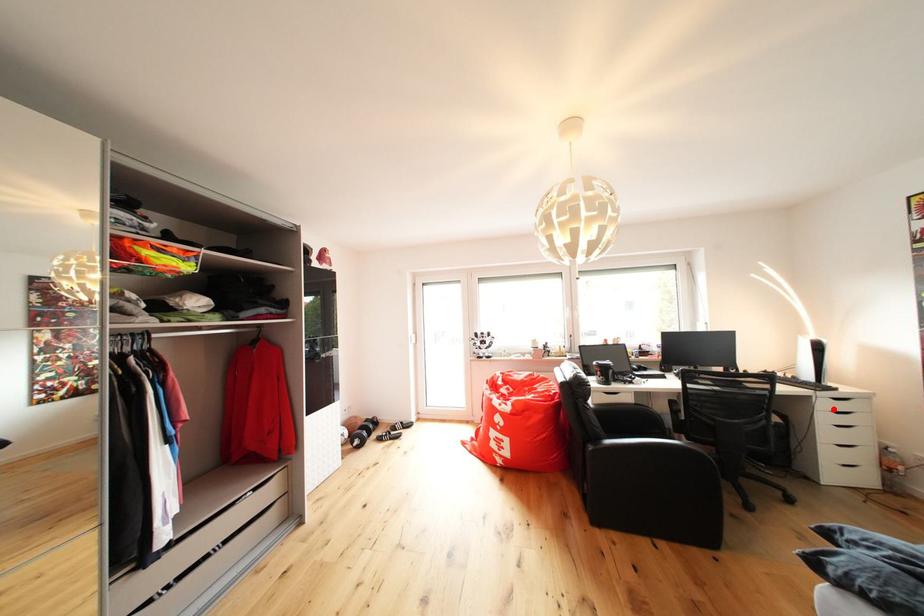
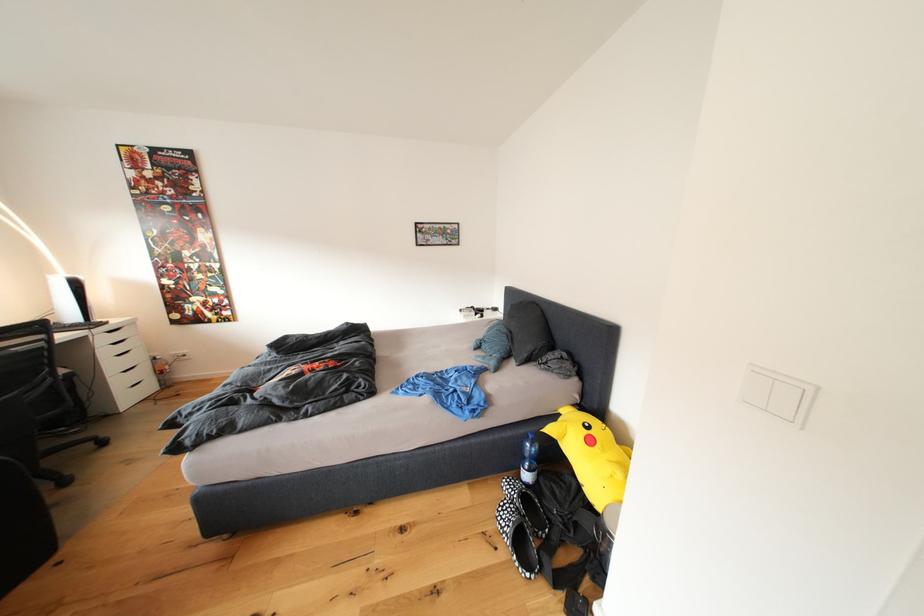
Question: I am providing you with two images of the same scene from different viewpoints. In image1, a red point is highlighted. Considering the same 3D point in image2, which of the following is correct?

Choices:
 (A) It is closer
 (B) It is farther

Answer: (B)